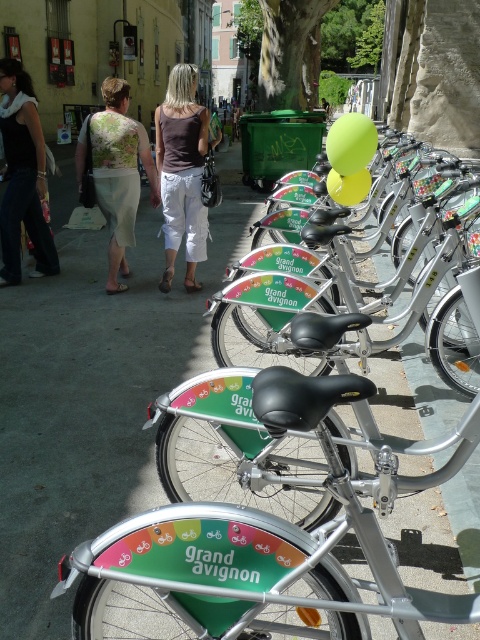
Does brown fabric tank top at center have a smaller size compared to floral fabric dress at left?

No.

Based on the photo, can you confirm if brown fabric tank top at center is shorter than floral fabric dress at left?

Incorrect, brown fabric tank top at center's height does not fall short of floral fabric dress at left's.

Between point (204, 120) and point (103, 86), which one is positioned in front?

Point (204, 120) is more forward.

Where is `brown fabric tank top at center`? This screenshot has width=480, height=640. brown fabric tank top at center is located at coordinates (181, 172).

Who is shorter, silver metallic bicycle at center or green fabric bag at center?

silver metallic bicycle at center is shorter.

Is point (445, 316) more distant than point (325, 108)?

No, it is not.

Which is in front, point (228, 301) or point (321, 97)?

Point (228, 301)

What are the coordinates of `silver metallic bicycle at center` in the screenshot? It's located at (344, 284).

Is black fabric dress at left thinner than floral fabric dress at left?

No, black fabric dress at left is not thinner than floral fabric dress at left.

Who is more distant from viewer, (43, 230) or (104, 214)?

The point (43, 230) is more distant.

Image resolution: width=480 pixels, height=640 pixels. What are the coordinates of `black fabric dress at left` in the screenshot? It's located at (23, 177).